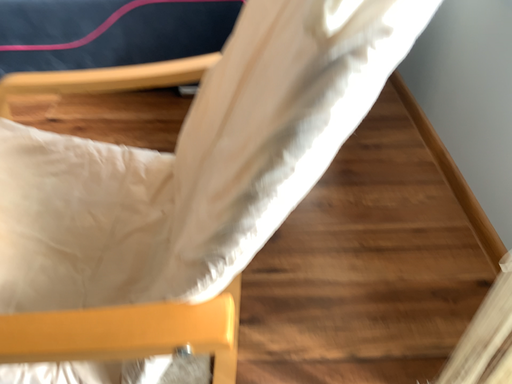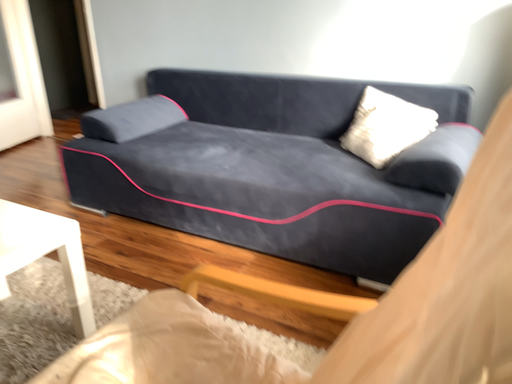
Question: How did the camera likely rotate when shooting the video?

Choices:
 (A) rotated upward
 (B) rotated downward

Answer: (A)